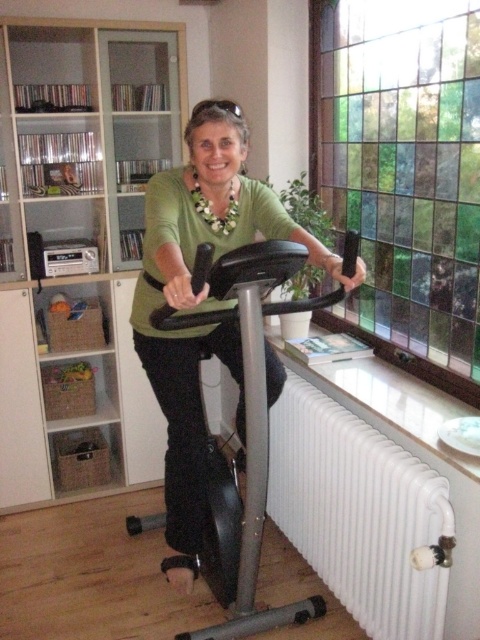
Is point (181, 419) positioned in front of point (437, 570)?

No, (181, 419) is behind (437, 570).

Between green matte shirt at center and white matte radiator at lower right, which one has less height?

Standing shorter between the two is white matte radiator at lower right.

Is point (156, 173) positioned before point (355, 540)?

No, (156, 173) is further to viewer.

You are a GUI agent. You are given a task and a screenshot of the screen. Output one action in this format:
    pyautogui.click(x=<x>, y=<y>)
    Task: Click on the green matte shirt at center
    This screenshot has height=640, width=480.
    Given the screenshot: What is the action you would take?
    pyautogui.click(x=203, y=301)

Does white glossy bookshelf at left have a greater height compared to white matte radiator at lower right?

Yes.

Is white glossy bookshelf at left above white matte radiator at lower right?

Indeed, white glossy bookshelf at left is positioned over white matte radiator at lower right.

You are a GUI agent. You are given a task and a screenshot of the screen. Output one action in this format:
    pyautogui.click(x=<x>, y=<y>)
    Task: Click on the white glossy bookshelf at left
    
    Given the screenshot: What is the action you would take?
    pyautogui.click(x=80, y=234)

Does white glossy bookshelf at left have a greater width compared to green matte shirt at center?

Correct, the width of white glossy bookshelf at left exceeds that of green matte shirt at center.

Who is more distant from viewer, (0, 452) or (172, 480)?

The point (0, 452) is more distant.

The image size is (480, 640). Find the location of `white glossy bookshelf at left`. white glossy bookshelf at left is located at coordinates (80, 234).